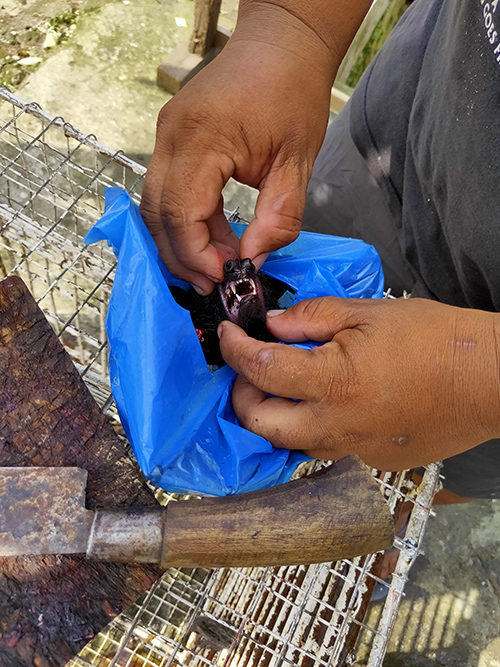
Find the location of a particular element. dark wood is located at coordinates (49, 407).